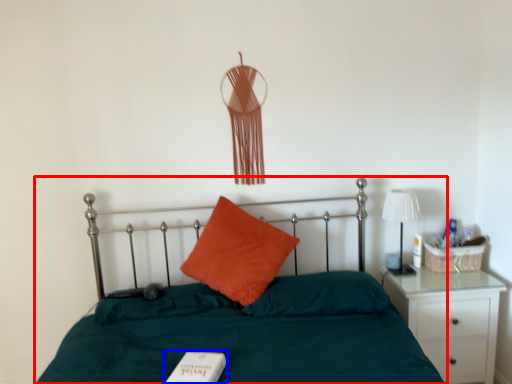
Question: Which point is further to the camera, bed (highlighted by a red box) or book (highlighted by a blue box)?

Choices:
 (A) bed
 (B) book

Answer: (B)